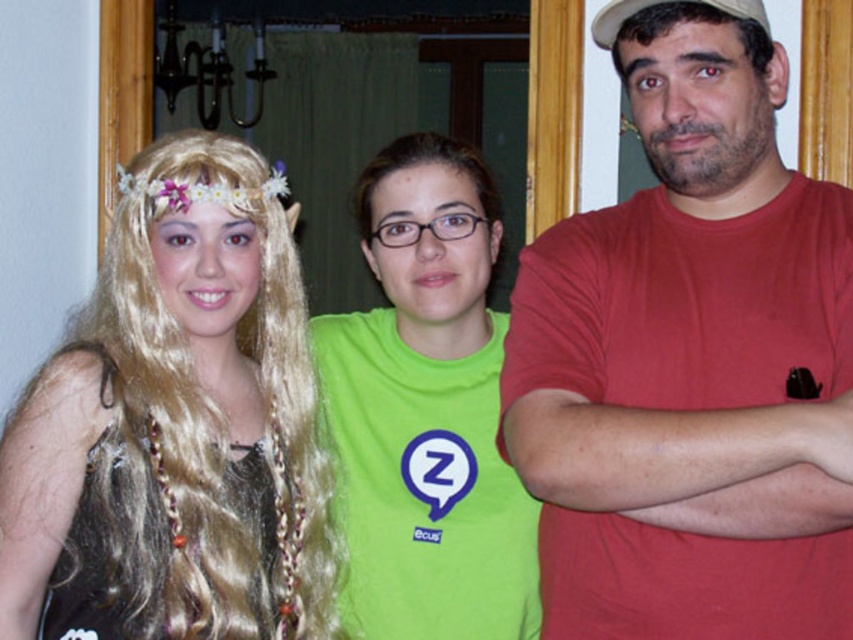
Is matte red t-shirt at center shorter than blonde hair at left?

Incorrect, matte red t-shirt at center's height does not fall short of blonde hair at left's.

Can you confirm if matte red t-shirt at center is smaller than blonde hair at left?

Actually, matte red t-shirt at center might be larger than blonde hair at left.

Locate an element on the screen. This screenshot has height=640, width=853. matte red t-shirt at center is located at coordinates (685, 355).

Does blonde wig at left appear over green matte shirt at center?

No, blonde wig at left is not above green matte shirt at center.

Can you confirm if blonde wig at left is bigger than green matte shirt at center?

Indeed, blonde wig at left has a larger size compared to green matte shirt at center.

Where is `blonde wig at left`? The width and height of the screenshot is (853, 640). blonde wig at left is located at coordinates (175, 426).

Locate an element on the screen. This screenshot has height=640, width=853. blonde wig at left is located at coordinates (175, 426).

Can you confirm if blonde wig at left is bigger than blonde hair at left?

Correct, blonde wig at left is larger in size than blonde hair at left.

Is blonde wig at left thinner than blonde hair at left?

No.

This screenshot has width=853, height=640. Describe the element at coordinates (175, 426) in the screenshot. I see `blonde wig at left` at that location.

The height and width of the screenshot is (640, 853). Find the location of `blonde wig at left`. blonde wig at left is located at coordinates (175, 426).